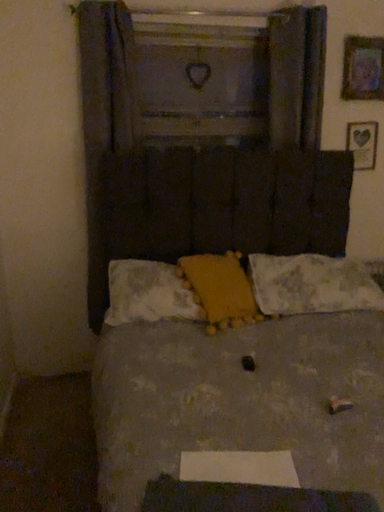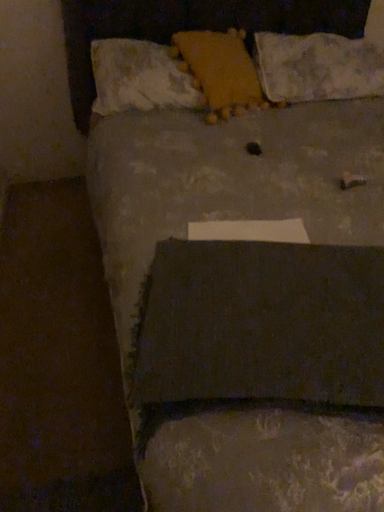
Question: Which way did the camera rotate in the video?

Choices:
 (A) rotated upward
 (B) rotated downward

Answer: (B)